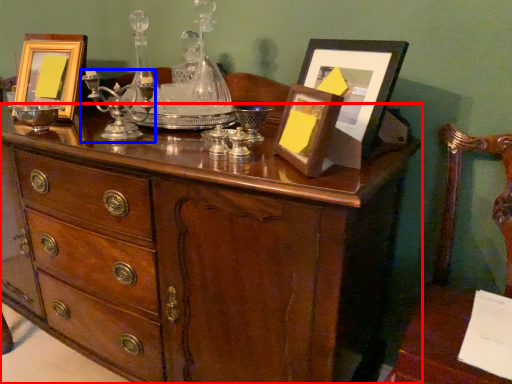
Question: Which object is closer to the camera taking this photo, chest of drawers (highlighted by a red box) or candle holder (highlighted by a blue box)?

Choices:
 (A) chest of drawers
 (B) candle holder

Answer: (A)